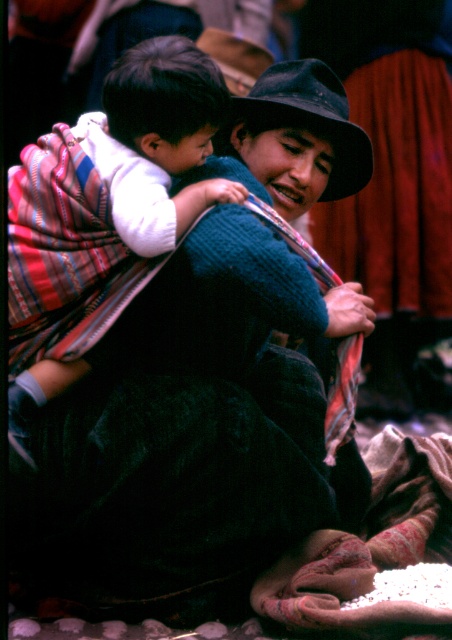
You are an observer standing in front of the image. You see the knitted dark blue sweater at center and the black felt hat at upper center. Which object is positioned to the left of the other?

The knitted dark blue sweater at center is to the left of black felt hat at upper center.

You are a photographer who wants to capture a closeup of the baby in the scene. You need to adjust your camera lens to focus on the baby, who is between the white soft cloth at center and the black felt hat at upper center. What is the minimum distance you should set your lens to focus on the baby?

The white soft cloth at center is 30.05 inches from the black felt hat at upper center. To focus on the baby between them, the lens should be set to at least 15.025 inches from the white soft cloth at center or equivalently 15.025 inches from the black felt hat at upper center, ensuring the baby is within the focal range.